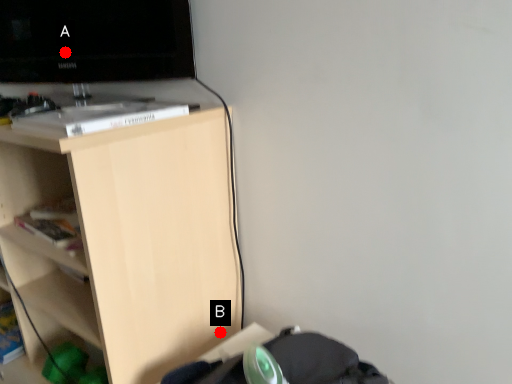
Question: Two points are circled on the image, labeled by A and B beside each circle. Among these points, which one is nearest to the camera?

Choices:
 (A) A is closer
 (B) B is closer

Answer: (A)